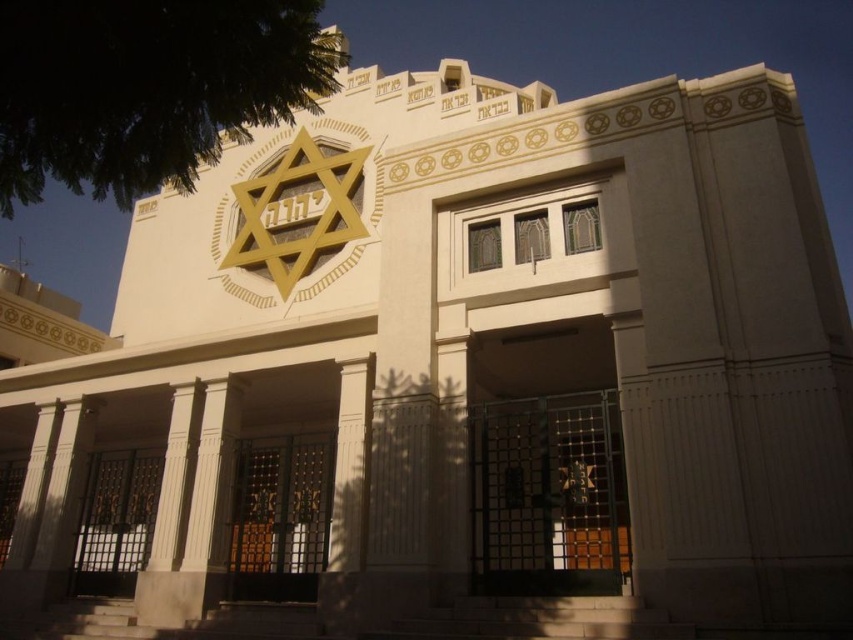
You are planning to bring a large delivery truck to the synagogue. The truck is 3 meters wide. You see both the metallic gate at center and the wooden gate at center. Which gate should you use to ensure the truck can pass through?

The metallic gate at center has a larger width than the wooden gate at center, so the truck should use the metallic gate at center to pass through since it is wider than 3 meters.

You are standing in front of the synagogue and want to enter through the gates. Which gate should you approach first, the metallic gate at center or the wooden gate at center?

You should approach the metallic gate at center first because it is closer to the viewer than the wooden gate at center.